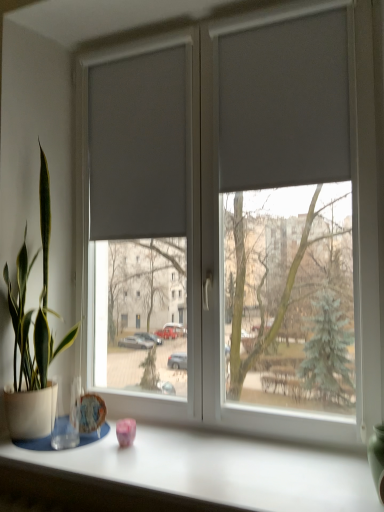
This screenshot has height=512, width=384. What are the coordinates of `vacant region above matte gray curtain at left, the 1th curtain when ordered from left to right (from a real-world perspective)` in the screenshot? It's located at (137, 40).